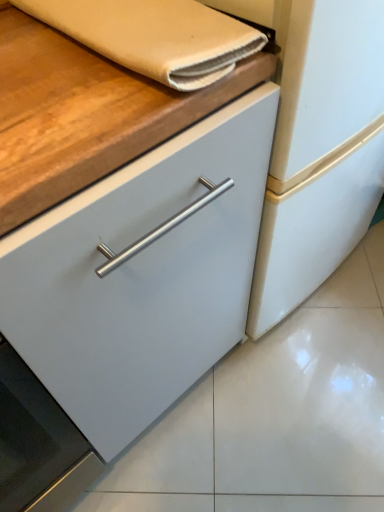
The image size is (384, 512). Identify the location of free space in front of beige fabric hand towel at upper left. (71, 110).